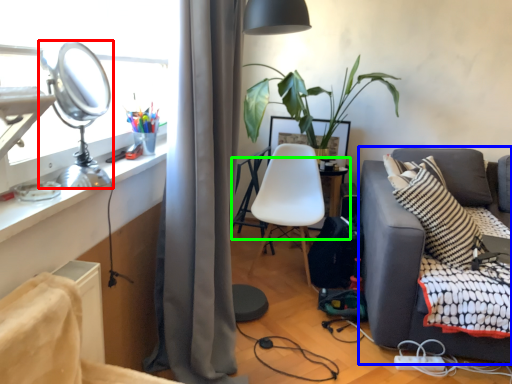
Question: Which is farther away from table lamp (highlighted by a red box)? studio couch (highlighted by a blue box) or table (highlighted by a green box)?

Choices:
 (A) studio couch
 (B) table

Answer: (B)